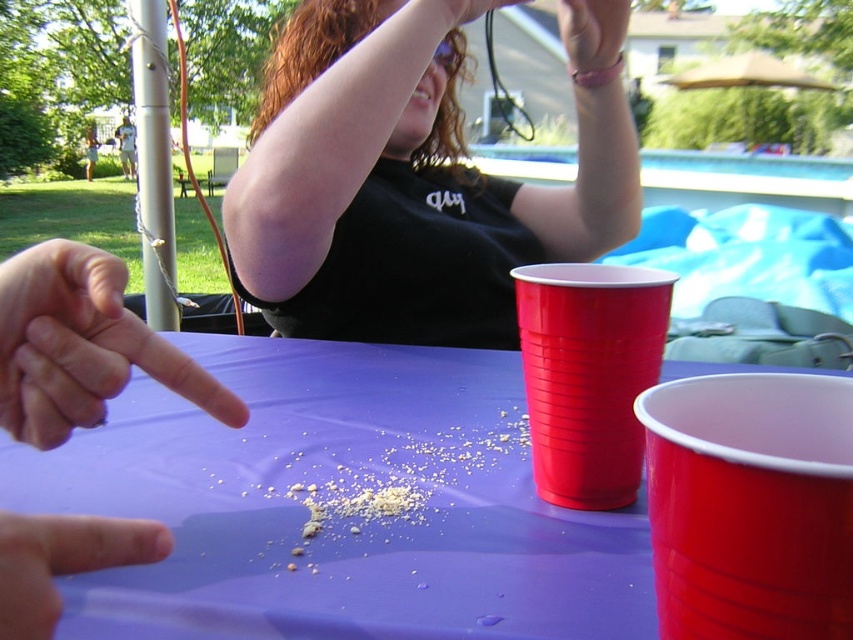
You are at the backyard gathering and want to grab a drink from the purple tablecloth covered table. There are two red plastic cups on the table. One is at the center right and the other is closer to you. Which cup is located at the exact point marked as (589, 374)?

The matte plastic cup at center right is located at point (589, 374).

You are holding a 20 centimeter long ruler and want to place it on the purple plastic table at center. Can the ruler fit entirely on the table without hanging off the edges?

The purple plastic table at center is 26.11 centimeters away from the camera, but this measurement refers to distance, not the table size. The question about the ruler fitting depends on the table dimensions, which are not provided in the objects description. Therefore, it is impossible to determine if the ruler will fit based on the given information.

Based on the photo, you are at a backyard party and see the black matte shirt at upper center and the matte plastic cup at center right. Which object takes up more space in the image?

The black matte shirt at upper center takes up more space in the image because it is bigger than the matte plastic cup at center right.